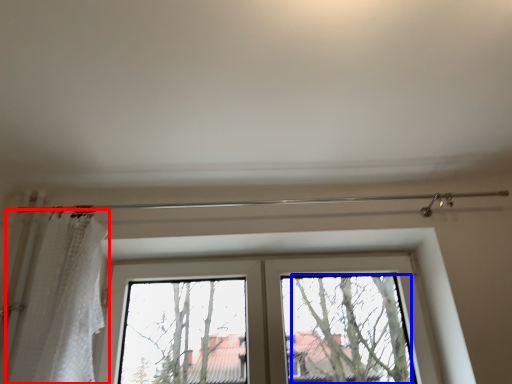
Question: Which object appears farthest to the camera in this image, shower curtain (highlighted by a red box) or tree (highlighted by a blue box)?

Choices:
 (A) shower curtain
 (B) tree

Answer: (B)